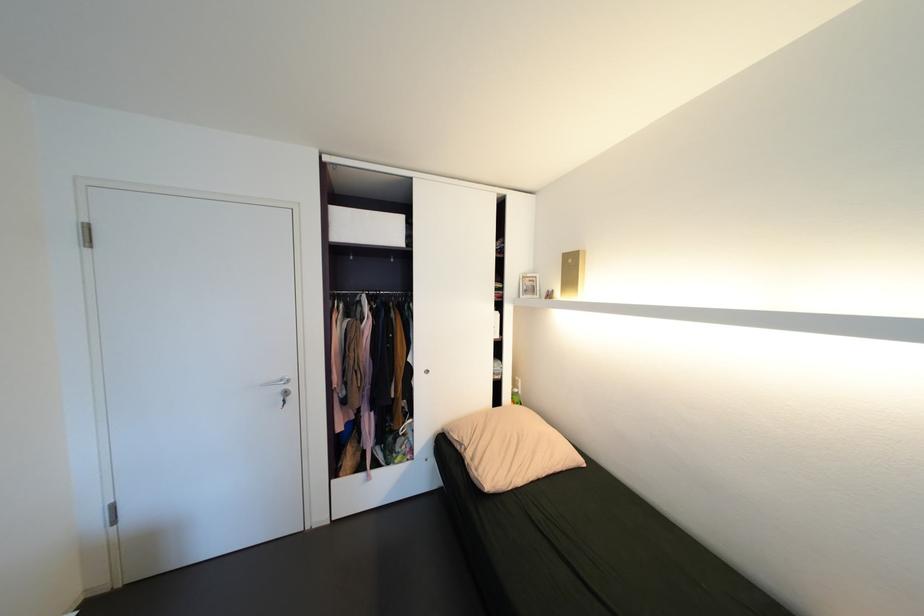
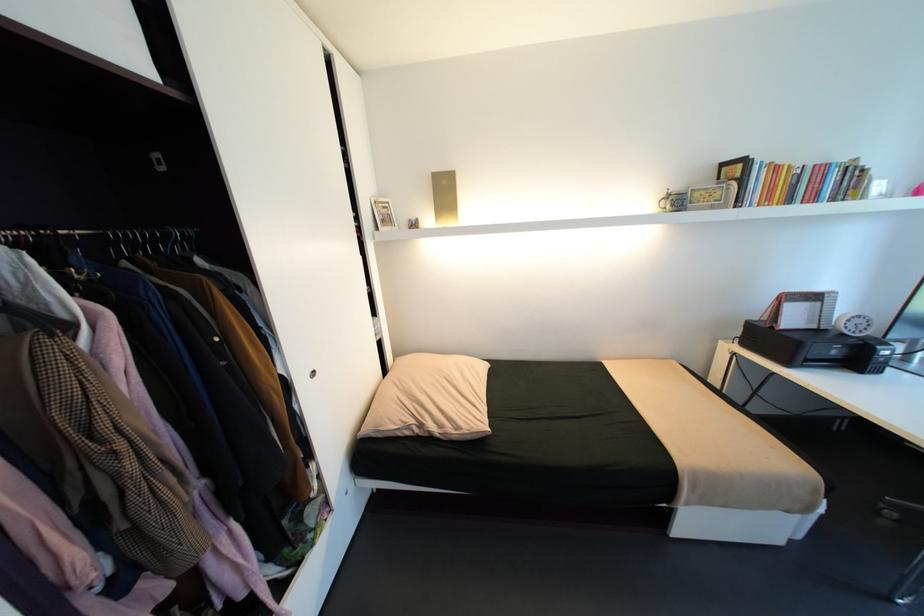
Locate, in the second image, the point that corresponds to [466,448] in the first image.

(415, 432)